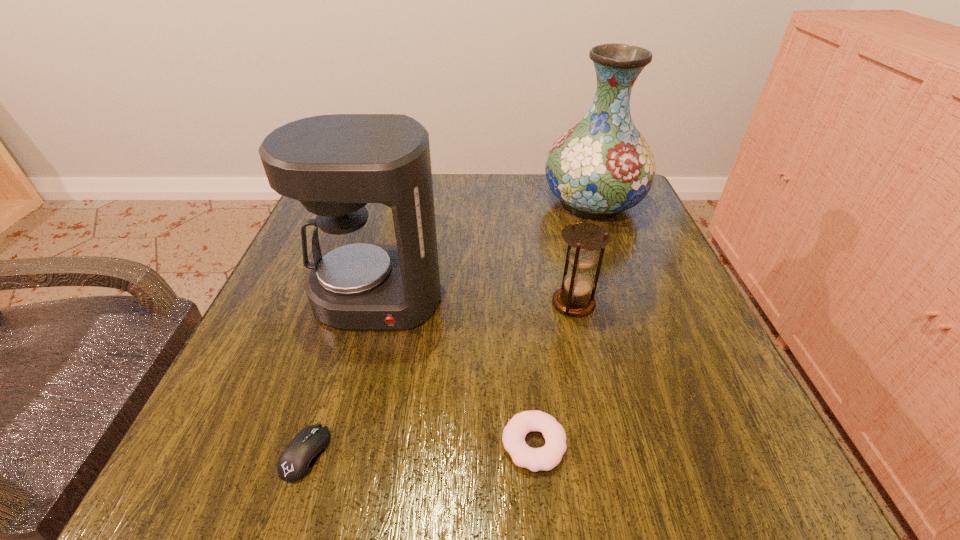
Find the location of a particular element. The width and height of the screenshot is (960, 540). vase is located at coordinates (603, 165).

Image resolution: width=960 pixels, height=540 pixels. I want to click on coffee maker, so click(334, 165).

This screenshot has height=540, width=960. What are the coordinates of `the third tallest object` in the screenshot? It's located at (584, 239).

Locate an element on the screen. computer equipment is located at coordinates (296, 461).

Locate an element on the screen. The height and width of the screenshot is (540, 960). the third object from right to left is located at coordinates (545, 458).

This screenshot has width=960, height=540. In order to click on blank space located 0.400m on the left of the farthest object in this screenshot , I will do tap(377, 204).

Where is `free space located on the button side of the coffee maker`? This screenshot has width=960, height=540. free space located on the button side of the coffee maker is located at coordinates (362, 358).

Where is `free space located on the left of the third tallest object`? This screenshot has height=540, width=960. free space located on the left of the third tallest object is located at coordinates (372, 303).

Where is `vacant position located 0.080m on the left of the computer equipment`? vacant position located 0.080m on the left of the computer equipment is located at coordinates (225, 454).

This screenshot has width=960, height=540. What are the coordinates of `blank area located 0.340m on the left of the doughnut` in the screenshot? It's located at (254, 444).